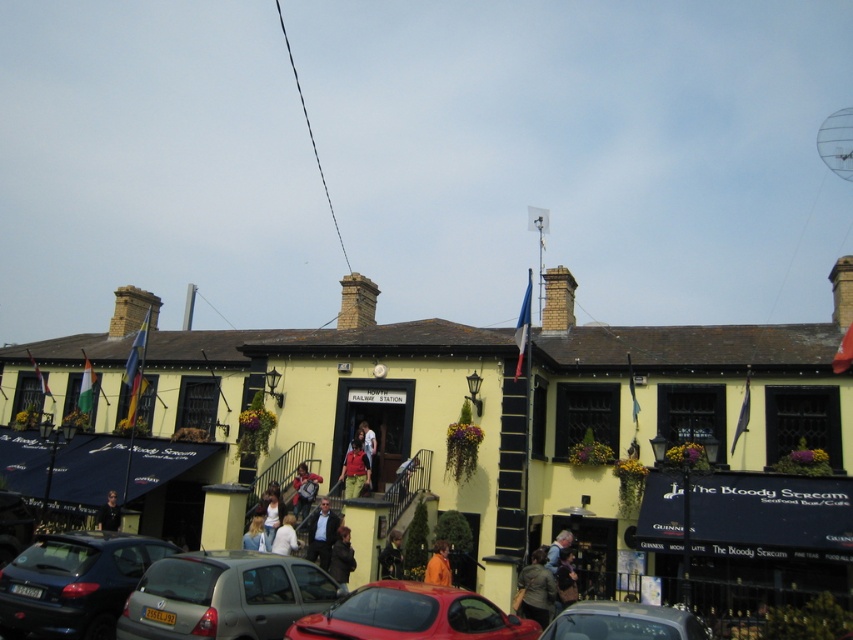
Question: Which object is the farthest from the dark blue suit at center?

Choices:
 (A) metallic silver car at lower center
 (B) dark brown leather jacket at center
 (C) dark gray jacket at center
 (D) orange fabric at lower center

Answer: (A)

Question: Which object is positioned farthest from the dark gray fabric jacket at lower right?

Choices:
 (A) dark brown leather jacket at center
 (B) orange fabric at lower center
 (C) denim jacket at center

Answer: (C)

Question: Does matte black car at lower left appear under dark brown leather jacket at lower center?

Choices:
 (A) yes
 (B) no

Answer: (B)

Question: Is dark blue suit at center further to camera compared to matte red shirt at center?

Choices:
 (A) no
 (B) yes

Answer: (A)

Question: Which object is the farthest from the dark gray jacket at center?

Choices:
 (A) orange fabric at lower center
 (B) light blue shirt at lower center

Answer: (B)

Question: Is orange fabric at lower center below light brown leather jacket at lower center?

Choices:
 (A) yes
 (B) no

Answer: (B)